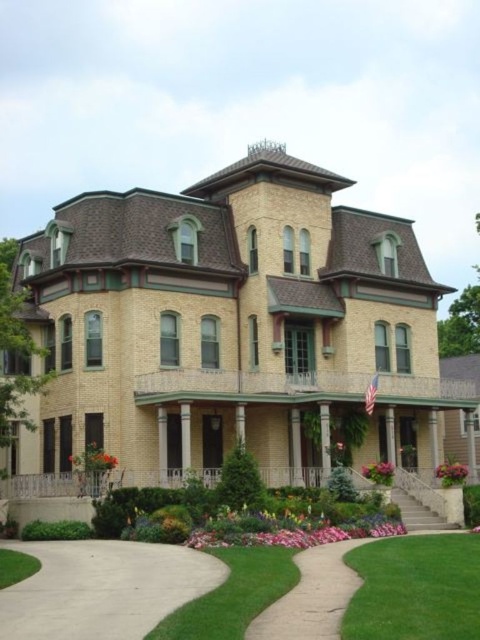
Can you confirm if green grass lawn at lower right is positioned to the right of pink matte flower at lower right?

No, green grass lawn at lower right is not to the right of pink matte flower at lower right.

Consider the image. Which is more to the left, green grass lawn at lower right or pink matte flower at lower right?

green grass lawn at lower right

Is point (457, 570) more distant than point (392, 465)?

No, it is not.

Where is `green grass lawn at lower right`? Image resolution: width=480 pixels, height=640 pixels. green grass lawn at lower right is located at coordinates (416, 588).

Between concrete at center and pink matte flower at center, which one appears on the right side from the viewer's perspective?

pink matte flower at center

Is concrete at center taller than pink matte flower at center?

Correct, concrete at center is much taller as pink matte flower at center.

What do you see at coordinates (312, 596) in the screenshot? The height and width of the screenshot is (640, 480). I see `concrete at center` at bounding box center [312, 596].

Locate an element on the screen. Image resolution: width=480 pixels, height=640 pixels. concrete at center is located at coordinates (312, 596).

Can you confirm if green grass lawn at lower right is positioned above concrete at center?

Yes, green grass lawn at lower right is above concrete at center.

Is green grass lawn at lower right thinner than concrete at center?

In fact, green grass lawn at lower right might be wider than concrete at center.

Which is behind, point (419, 596) or point (344, 586)?

Point (344, 586)

This screenshot has height=640, width=480. In order to click on green grass lawn at lower right in this screenshot , I will do `click(416, 588)`.